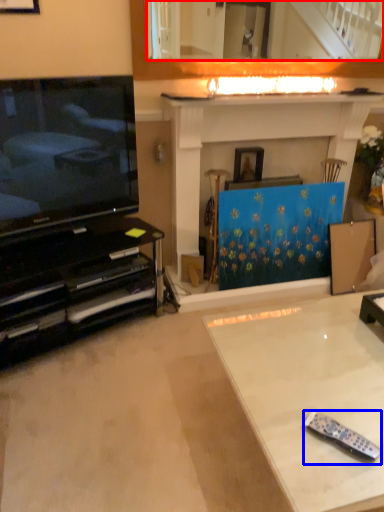
Question: Which of the following is the farthest to the observer, mirror (highlighted by a red box) or remote control (highlighted by a blue box)?

Choices:
 (A) mirror
 (B) remote control

Answer: (A)